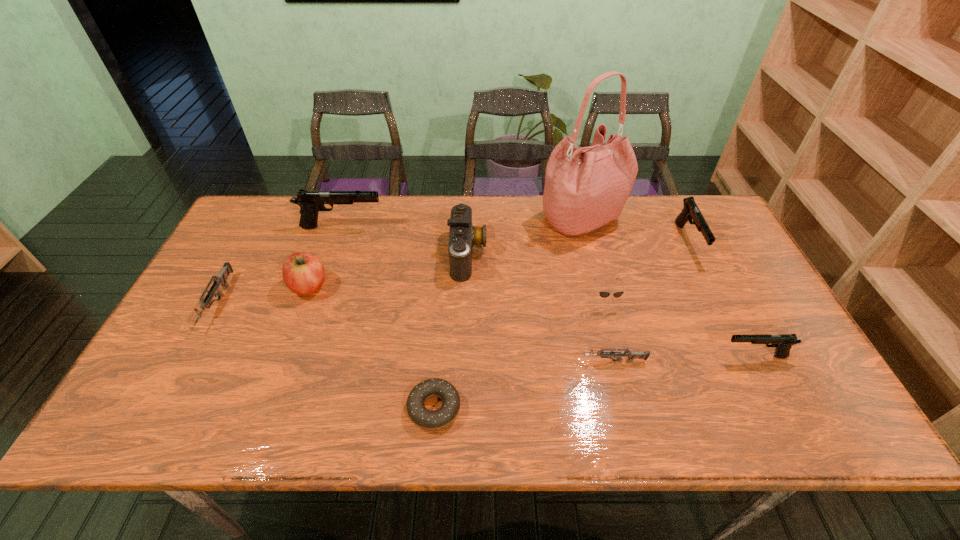
Image resolution: width=960 pixels, height=540 pixels. In order to click on camera located at the far edge in this screenshot , I will do `click(463, 235)`.

This screenshot has width=960, height=540. Identify the location of object that is positioned at the near edge. (426, 419).

You are a GUI agent. You are given a task and a screenshot of the screen. Output one action in this format:
    pyautogui.click(x=<x>, y=<y>)
    Task: Click on the object that is at the left edge
    The image size is (960, 540).
    Given the screenshot: What is the action you would take?
    pyautogui.click(x=221, y=279)

What are the coordinates of `object that is positioned at the far right corner` in the screenshot? It's located at (x=690, y=211).

Locate an element on the screen. vacant area at the far edge is located at coordinates (374, 230).

Image resolution: width=960 pixels, height=540 pixels. What are the coordinates of `vacant point at the left edge` in the screenshot? It's located at (149, 385).

Identify the location of vacant region at the right edge of the desktop. The height and width of the screenshot is (540, 960). (737, 266).

I want to click on empty space between the second smallest black gun and the brown doughnut, so click(x=561, y=325).

The width and height of the screenshot is (960, 540). Identify the location of free point between the apple and the handbag. (445, 253).

Identify the location of vacant area that lies between the ninth tallest object and the camera. Image resolution: width=960 pixels, height=540 pixels. (540, 308).